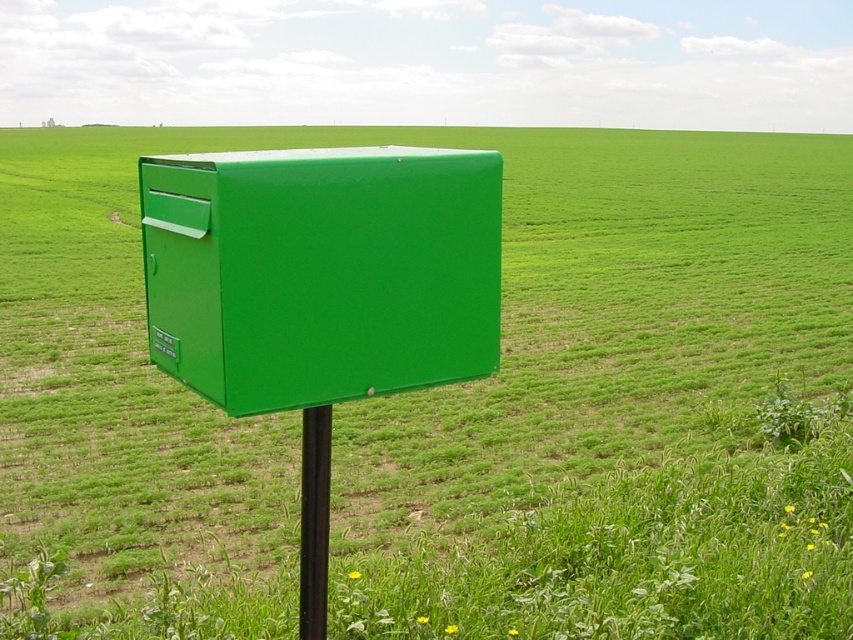
You are a mail carrier who needs to deliver a large package to the mailbox. The package is 2 meters tall. Can you fit the package into the green glossy mailbox at center mounted on the black metal pole at center?

The green glossy mailbox at center is much taller than the black metal pole at center, but the description does not specify the mailbox height in meters. Without knowing the exact height of the mailbox, it is impossible to determine if the 2m package will fit.

You are a mail carrier trying to determine if you can fit a large package into the green glossy mailbox at center. The package is the same size as the black metal pole at center. Will it fit inside the mailbox?

The green glossy mailbox at center is larger in size than the black metal pole at center, so the package should fit inside the mailbox as it is smaller than the mailbox itself.

You are a postal worker who needs to deliver a package to the mailbox. The package is 14 inches wide. Can you place the package between the green glossy mailbox at center and the black metal pole at center?

The distance between the green glossy mailbox at center and the black metal pole at center is 13.91 inches. Since the package is 14 inches wide, it cannot fit between them as the space is slightly narrower than the package.